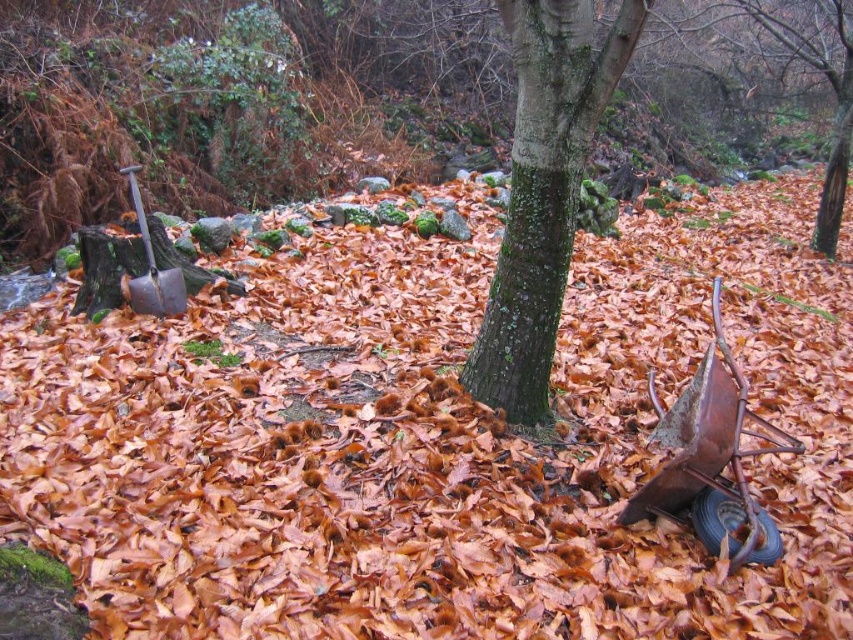
Is green mossy bark tree at center taller than shiny metallic shovel at left?

Yes, green mossy bark tree at center is taller than shiny metallic shovel at left.

Can you confirm if green mossy bark tree at center is positioned above shiny metallic shovel at left?

Indeed, green mossy bark tree at center is positioned over shiny metallic shovel at left.

The image size is (853, 640). What do you see at coordinates (543, 192) in the screenshot?
I see `green mossy bark tree at center` at bounding box center [543, 192].

Find the location of a particular element. Image resolution: width=853 pixels, height=640 pixels. green mossy bark tree at center is located at coordinates (543, 192).